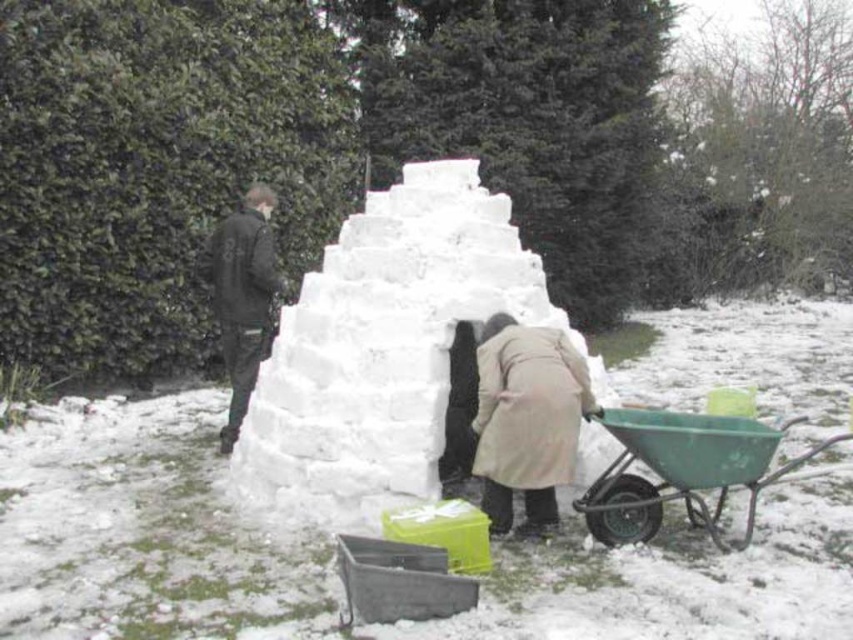
Based on the coordinates provided in the scene description, where is the white snow igloo at center located?

The white snow igloo at center is located at point (386, 348).

Based on the photo, you are trying to take a photo of the light beige coat at center without including the green leafy hedge at upper left in the frame. Based on their sizes, is it possible to do so?

The green leafy hedge at upper left is larger than the light beige coat at center, so it may be challenging to exclude the hedge from the photo if they are both within the camera frame. Adjust your position or zoom to focus solely on the smaller light beige coat at center.

Based on the scene description, where is the green leafy hedge at upper left located in the image?

The green leafy hedge at upper left is located at point (157, 170) in the image.